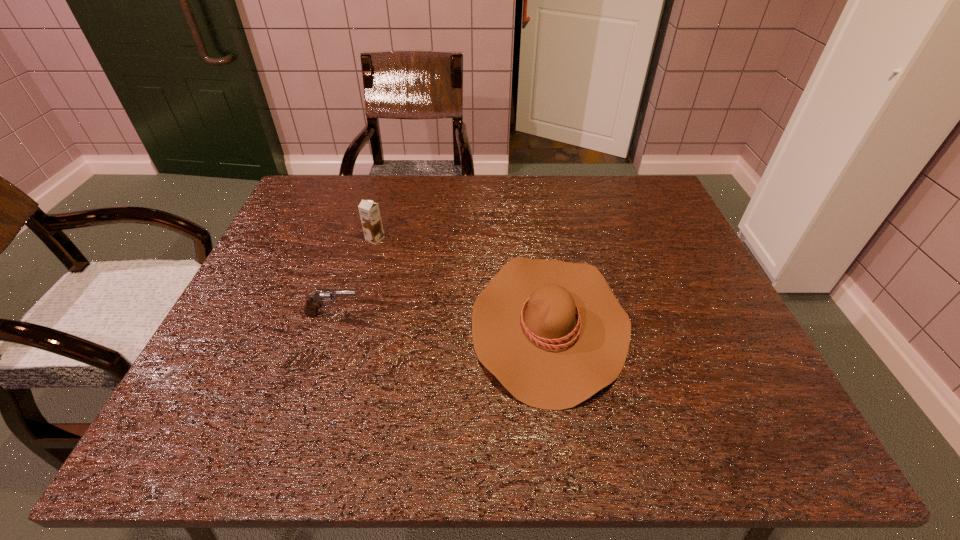
The height and width of the screenshot is (540, 960). Find the location of `vacant area in the image that satisfies the following two spatial constraints: 1. at the barrel of the cowboy hat; 2. on the left side of the pistol`. vacant area in the image that satisfies the following two spatial constraints: 1. at the barrel of the cowboy hat; 2. on the left side of the pistol is located at coordinates (330, 323).

Find the location of a particular element. The height and width of the screenshot is (540, 960). vacant area in the image that satisfies the following two spatial constraints: 1. at the barrel of the rightmost object; 2. on the right side of the pistol is located at coordinates (330, 323).

The image size is (960, 540). Find the location of `blank area in the image that satisfies the following two spatial constraints: 1. on the back side of the cowboy hat; 2. at the barrel of the pistol`. blank area in the image that satisfies the following two spatial constraints: 1. on the back side of the cowboy hat; 2. at the barrel of the pistol is located at coordinates (548, 314).